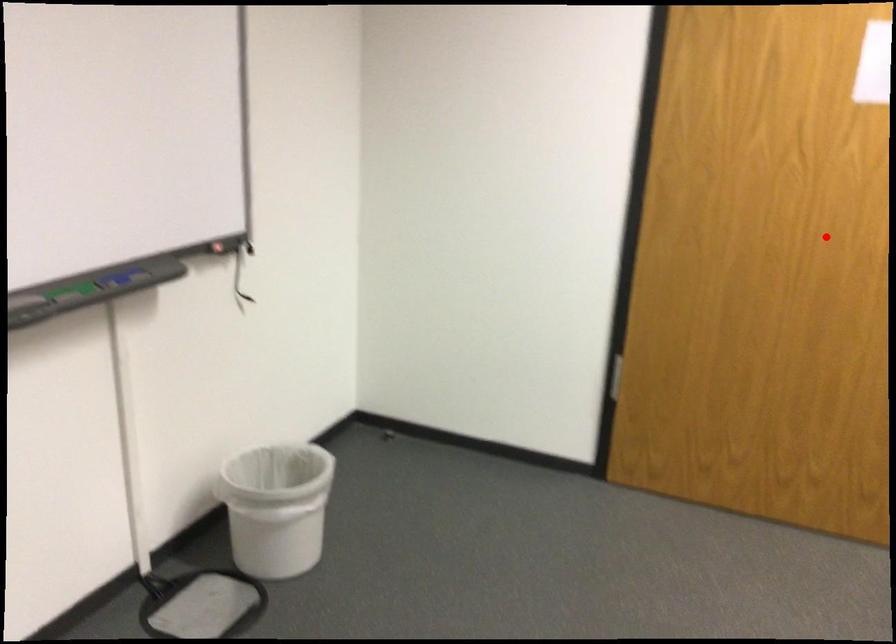
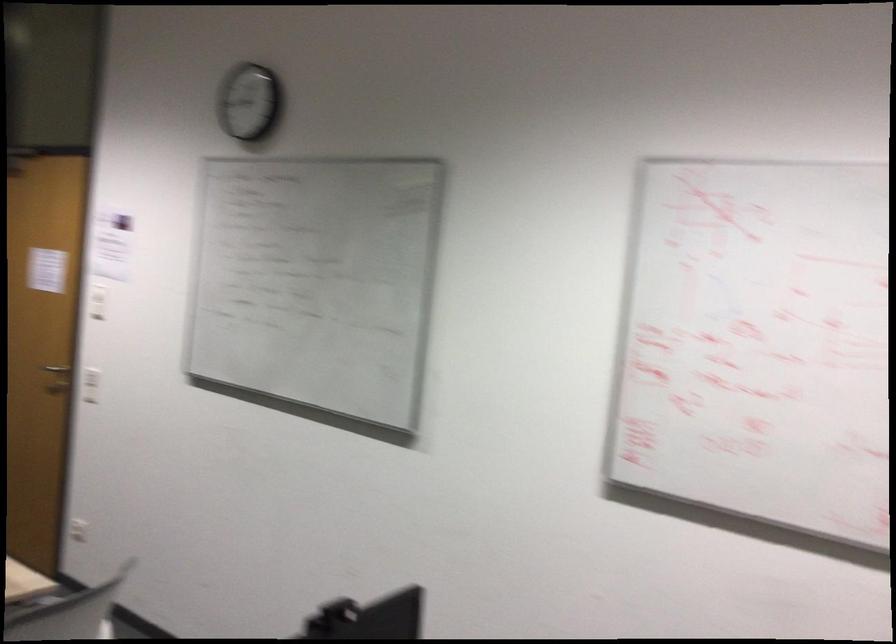
Question: I am providing you with two images of the same scene from different viewpoints. Given a red point in image1, look at the same physical point in image2. Is it:

Choices:
 (A) Closer to the viewpoint
 (B) Farther from the viewpoint

Answer: (B)